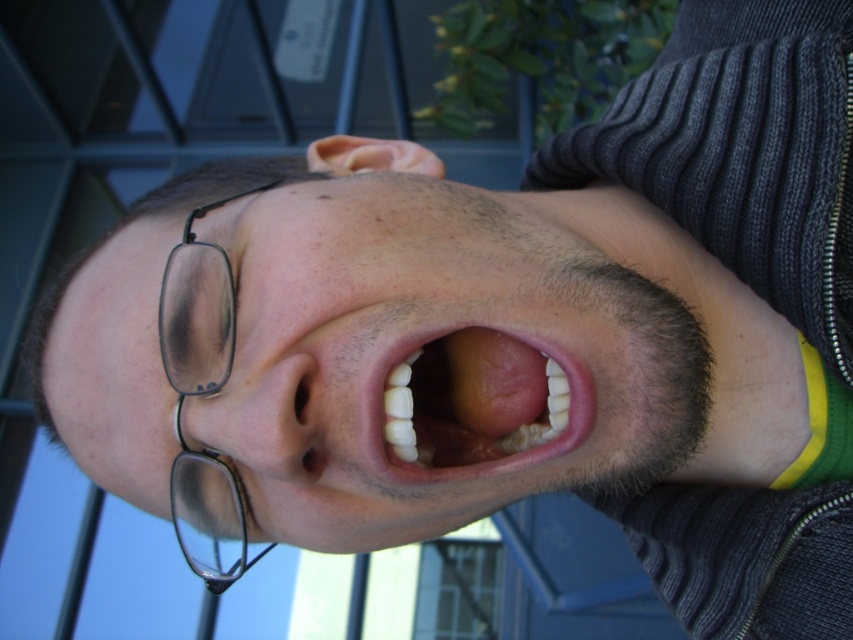
You are a photographer trying to capture a close shot of someone. You notice the white glossy teeth at center and the black plastic glasses at left in your viewfinder. Which object will appear wider in the photo?

The white glossy teeth at center will appear wider in the photo since its width is larger than the black plastic glasses at left.